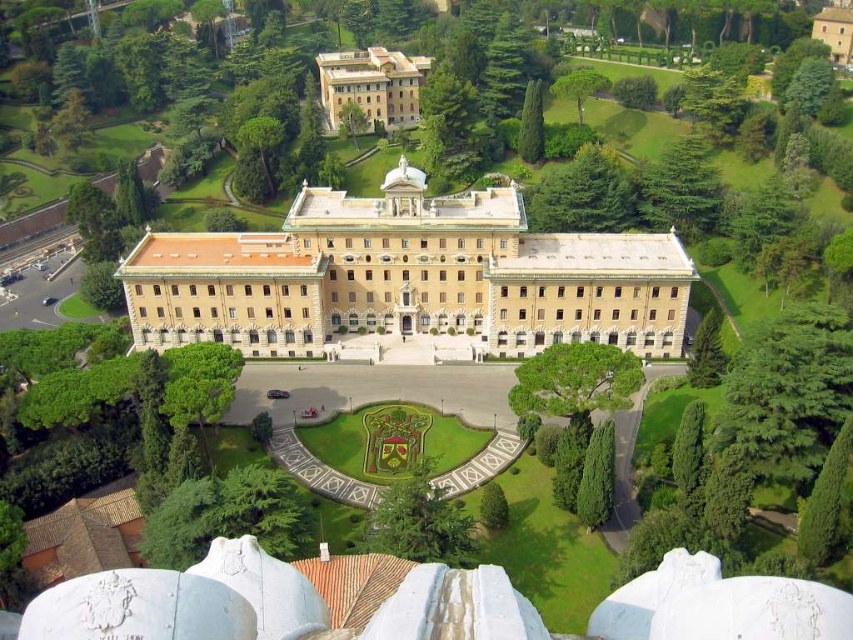
You are an architect designing a new pathway between the beige stone building at center and the beige stone building at upper center. The pathway must be at least 10 feet wide to accommodate foot traffic. Given the distance between them, what is the minimum width the pathway can be while still meeting the requirement?

The minimum width the pathway can be is 10 feet, as the distance between the beige stone building at center and the beige stone building at upper center is 170.91 feet, which allows for a pathway that meets the 10 feet width requirement.

You are standing in the plaza in front of the beige stone building at center and the beige stone building at upper center. Which one is positioned to the right of the other?

The beige stone building at center is positioned to the right of the beige stone building at upper center.

You are an architect analyzing the symmetry of the beige stone building at center and the beige stone building at upper center. Which one appears wider from your perspective?

The beige stone building at center appears wider than the beige stone building at upper center because its width is larger.